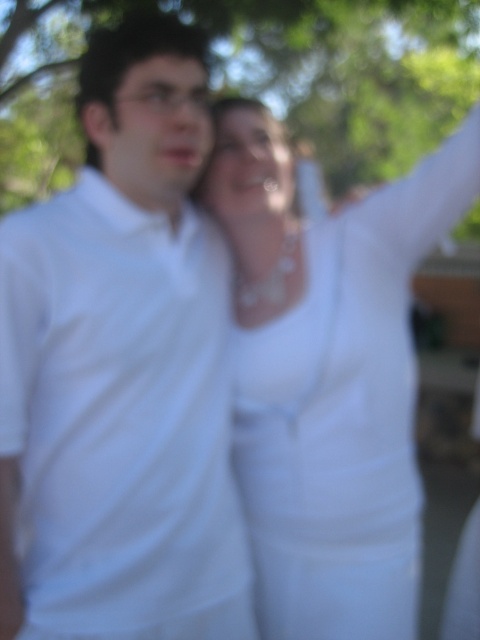
Is point (17, 403) positioned in front of point (237, 106)?

That is True.

Who is positioned more to the left, white matte shirt at left or white fabric dress at upper center?

From the viewer's perspective, white matte shirt at left appears more on the left side.

Describe the element at coordinates (121, 371) in the screenshot. I see `white matte shirt at left` at that location.

At what (x,y) coordinates should I click in order to perform the action: click on white matte shirt at left. Please return your answer as a coordinate pair (x, y). The width and height of the screenshot is (480, 640). Looking at the image, I should click on (121, 371).

Between white fabric dress at upper center and green leafy tree at upper center, which one is positioned higher?

green leafy tree at upper center

Which is below, white fabric dress at upper center or green leafy tree at upper center?

white fabric dress at upper center

Where is `white fabric dress at upper center`? The height and width of the screenshot is (640, 480). white fabric dress at upper center is located at coordinates (327, 376).

The width and height of the screenshot is (480, 640). I want to click on white fabric dress at upper center, so click(327, 376).

Is white matte shirt at left closer to camera compared to green leafy tree at upper center?

Yes, it is.

Find the location of a particular element. white matte shirt at left is located at coordinates (121, 371).